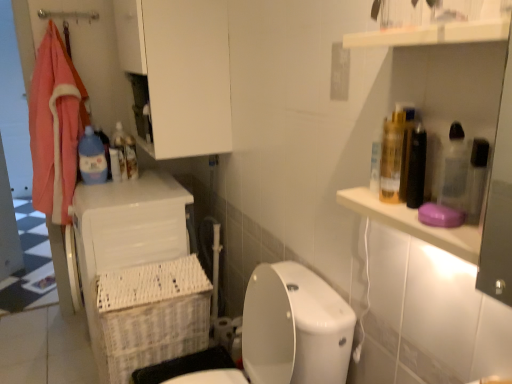
You are a GUI agent. You are given a task and a screenshot of the screen. Output one action in this format:
    pyautogui.click(x=<x>, y=<y>)
    Task: Click on the free location to the left of white plastic laundry basket at lower left
    This screenshot has height=384, width=512.
    Given the screenshot: What is the action you would take?
    pyautogui.click(x=40, y=337)